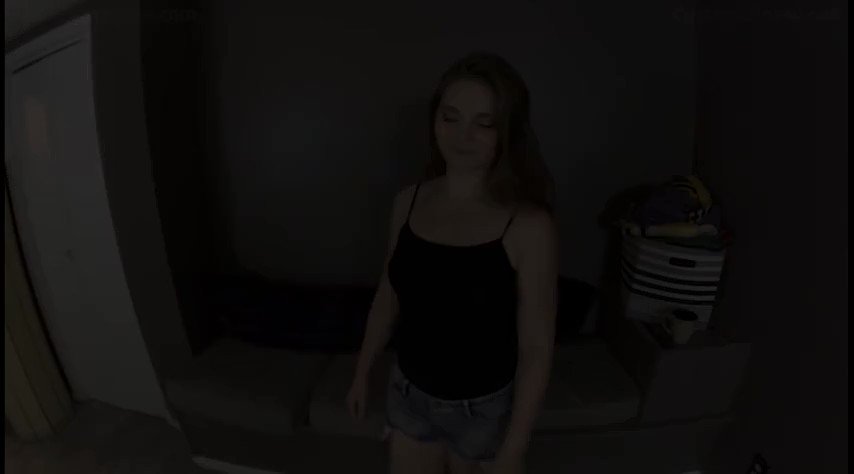
The height and width of the screenshot is (474, 854). Identify the location of mug. (679, 326).